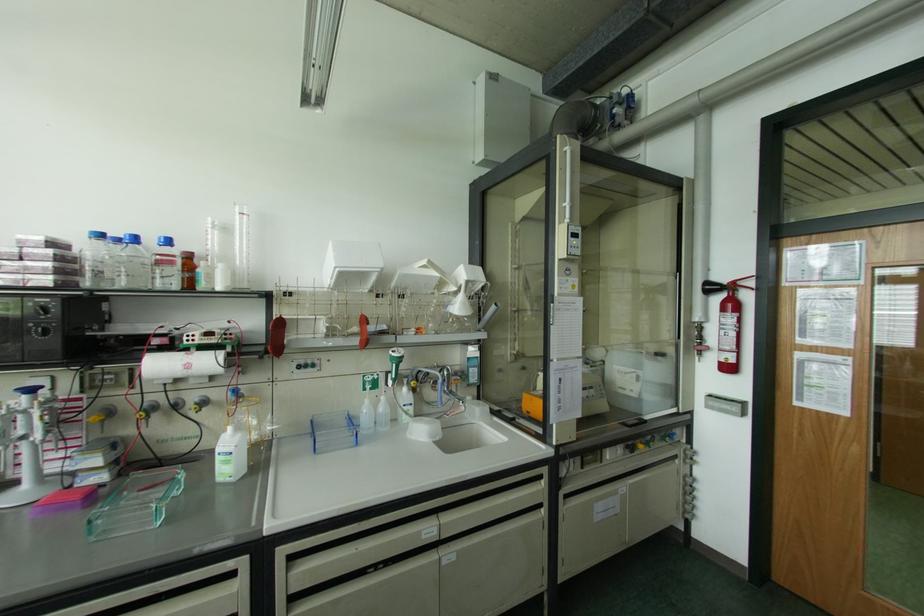
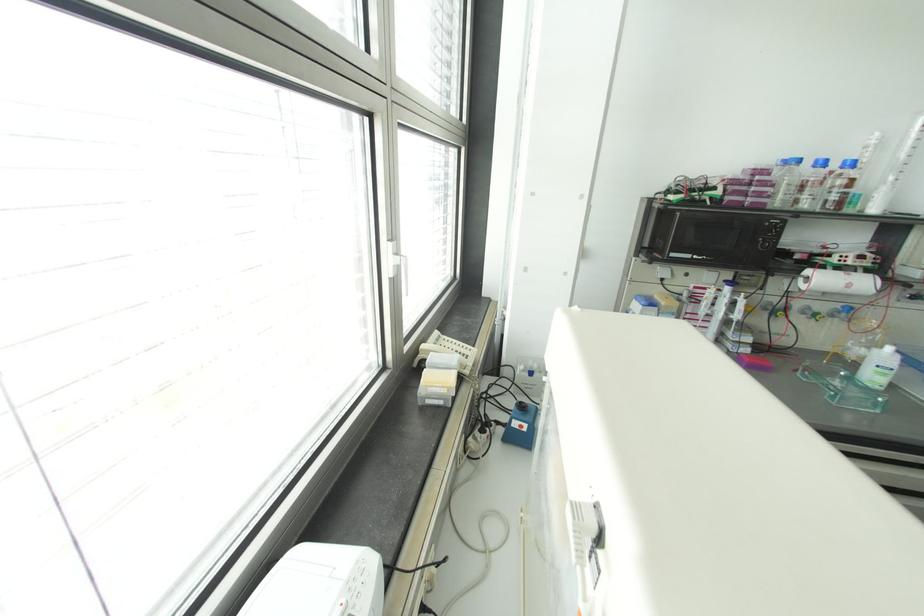
Find the pixel in the second image that matches point (37, 436) in the first image.

(736, 315)